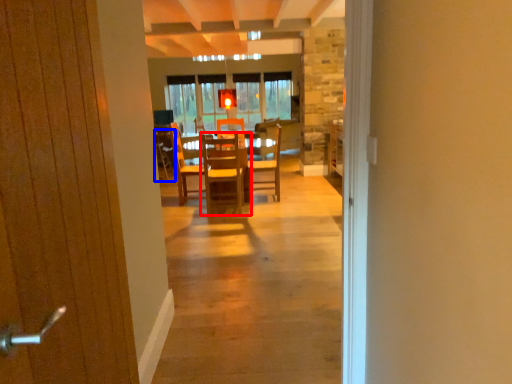
Question: Among these objects, which one is nearest to the camera, chair (highlighted by a red box) or armchair (highlighted by a blue box)?

Choices:
 (A) chair
 (B) armchair

Answer: (A)